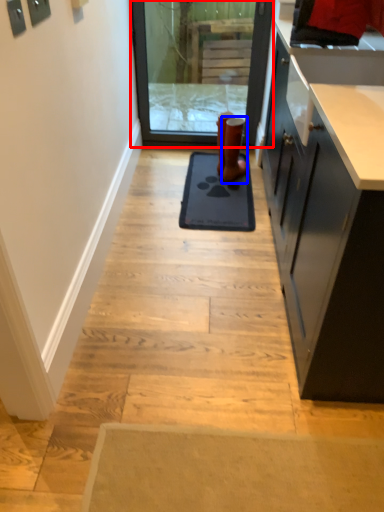
Question: Which object is closer to the camera taking this photo, screen door (highlighted by a red box) or footwear (highlighted by a blue box)?

Choices:
 (A) screen door
 (B) footwear

Answer: (B)